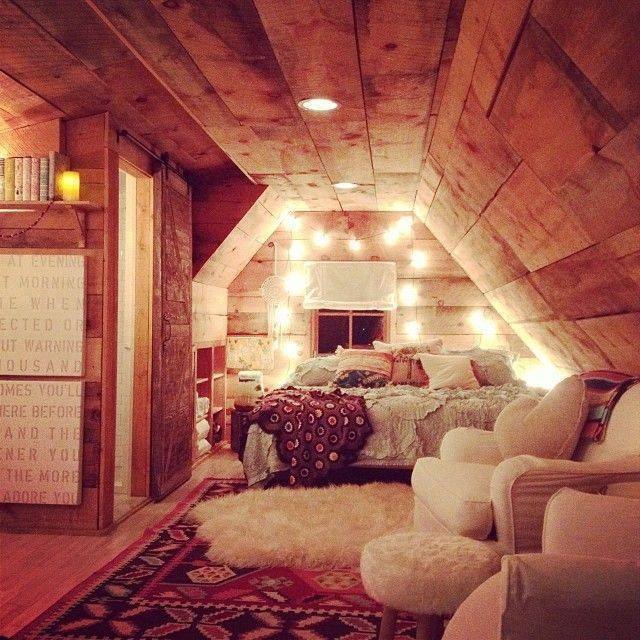
The width and height of the screenshot is (640, 640). What are the coordinates of `bookcase` in the screenshot? It's located at (211, 378).